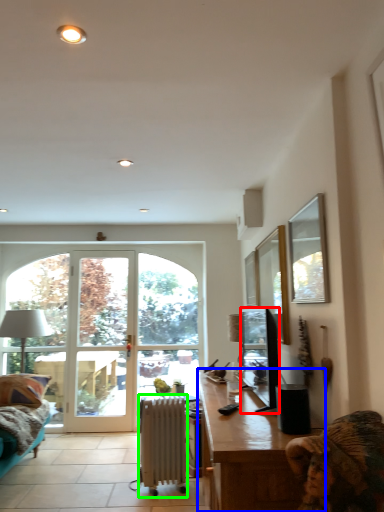
Question: Based on their relative distances, which object is farther from television (highlighted by a red box)? Choose from desk (highlighted by a blue box) and radiator (highlighted by a green box).

Choices:
 (A) desk
 (B) radiator

Answer: (B)